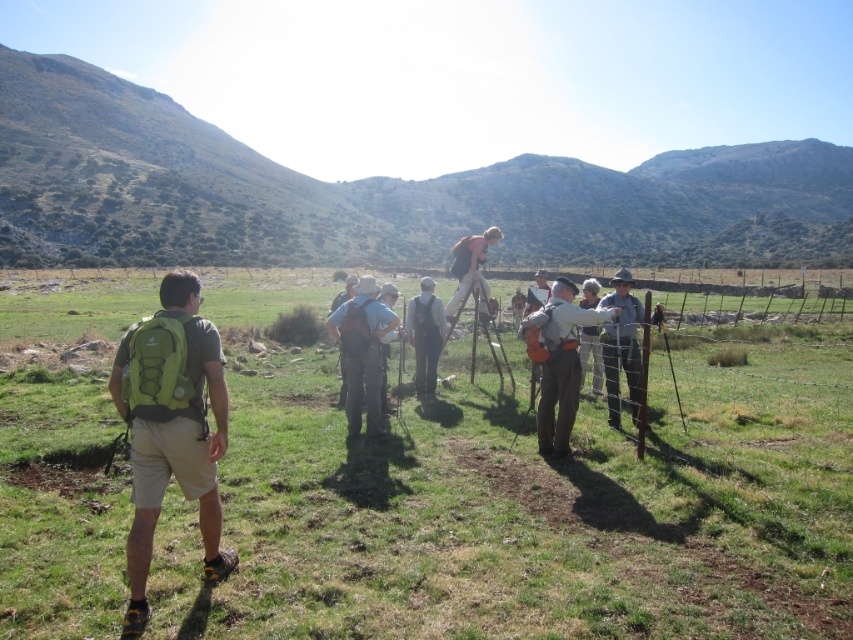
Question: Can you confirm if denim overalls at center is thinner than pink fabric at upper center?

Choices:
 (A) no
 (B) yes

Answer: (B)

Question: Is orange fabric backpack at right to the right of light gray backpack at center from the viewer's perspective?

Choices:
 (A) no
 (B) yes

Answer: (B)

Question: Which point is farther to the camera?

Choices:
 (A) orange fabric backpack at right
 (B) green fabric backpack at left
 (C) pink fabric at upper center
 (D) light gray backpack at center

Answer: (C)

Question: Which object is farther from the camera taking this photo?

Choices:
 (A) khaki fabric shirt at right
 (B) pink fabric at upper center
 (C) green fabric backpack at left

Answer: (B)

Question: Estimate the real-world distances between objects in this image. Which object is farther from the denim overalls at center?

Choices:
 (A) orange fabric backpack at right
 (B) green fabric backpack at left
 (C) pink fabric at upper center

Answer: (C)

Question: Where is light gray backpack at center located in relation to pink fabric at upper center in the image?

Choices:
 (A) above
 (B) below

Answer: (B)